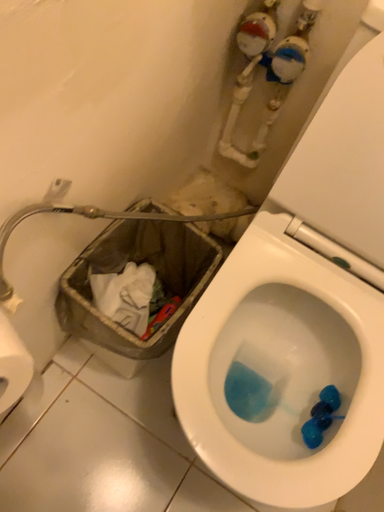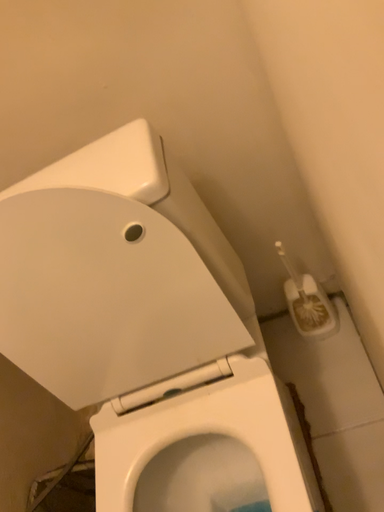
Question: How did the camera likely rotate when shooting the video?

Choices:
 (A) rotated upward
 (B) rotated downward

Answer: (A)